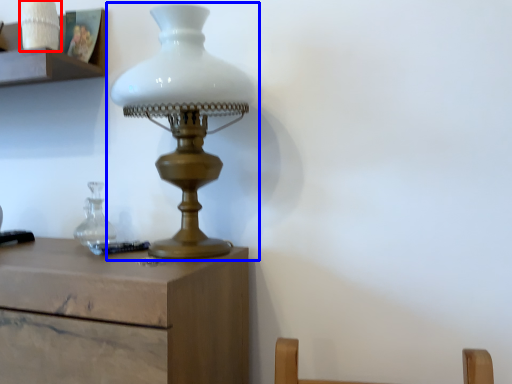
Question: Which point is closer to the camera, candle holder (highlighted by a red box) or lamp (highlighted by a blue box)?

Choices:
 (A) candle holder
 (B) lamp

Answer: (B)